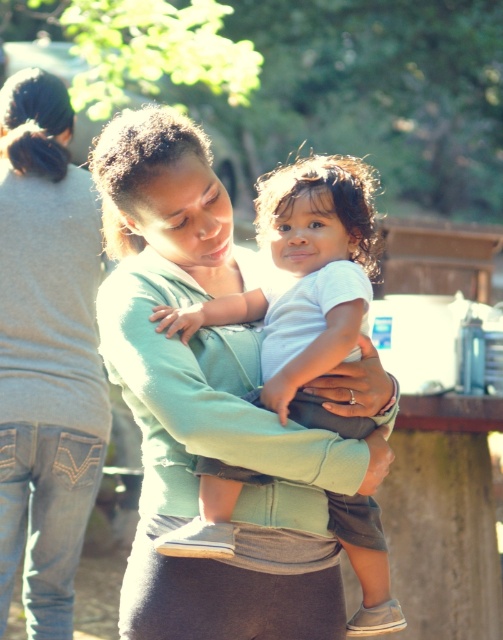
You are a photographer trying to capture a closeup shot of the matte green sweater at center and the white soft cotton baby at center. Since you want to focus on both subjects equally, which one should you adjust your camera lens to prioritize focusing on first?

The matte green sweater at center is taller than the white soft cotton baby at center, so you should prioritize focusing on the taller matte green sweater at center first to ensure both are in focus.

You are a photographer trying to capture the position of the matte green sweater at center and the white soft cotton baby at center. Based on the scene, which object is positioned to the left?

The matte green sweater at center is to the left of the white soft cotton baby at center according to the description.